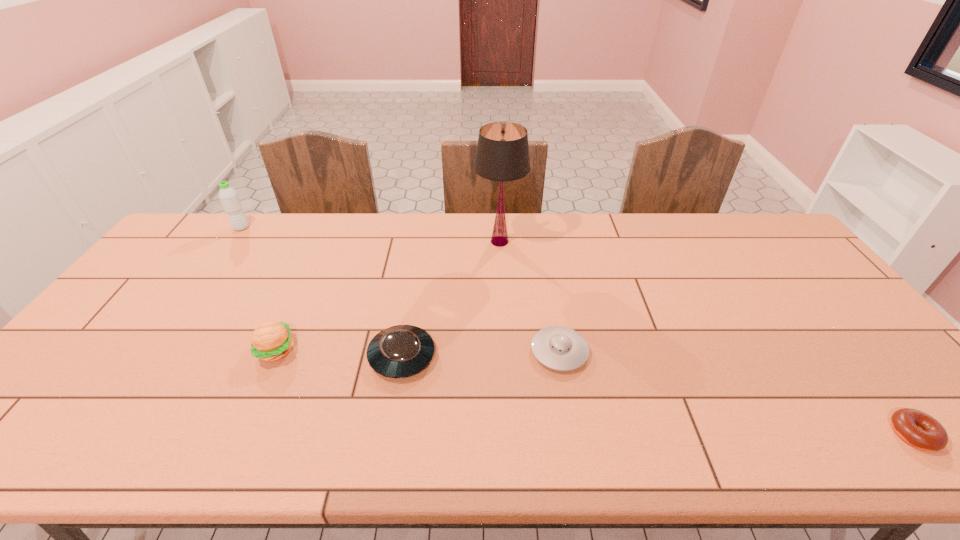
Find the location of a particular element. Image resolution: width=960 pixels, height=540 pixels. vacant position in the image that satisfies the following two spatial constraints: 1. on the front-facing side of the tallest object; 2. on the right side of the doughnut is located at coordinates (511, 434).

Identify the location of free space that satisfies the following two spatial constraints: 1. on the front-facing side of the tallest object; 2. on the right side of the shortest object. (511, 434).